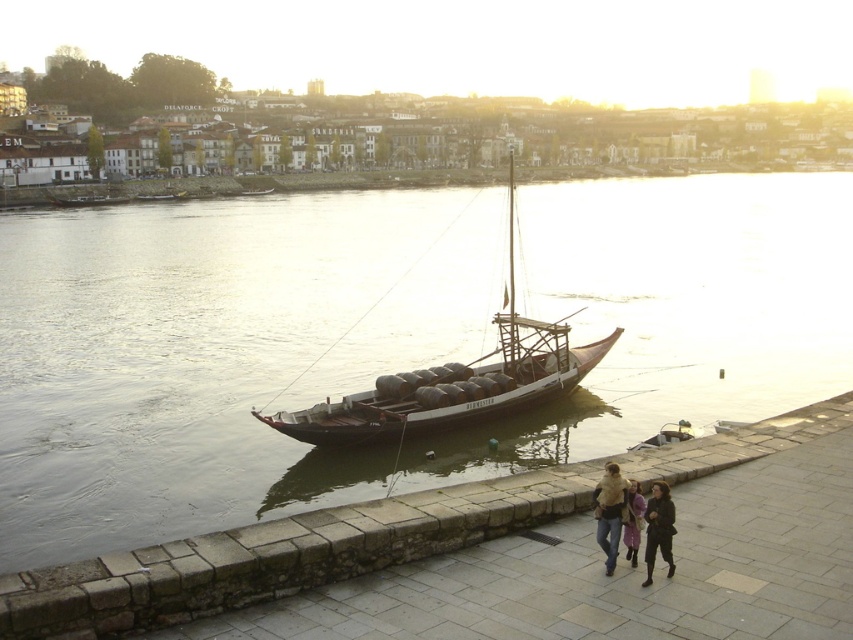
Question: Which object is the closest to the transparent water at center?

Choices:
 (A) smooth stone walkway at lower center
 (B) wooden barrel boat at center

Answer: (B)

Question: Does transparent water at center lie behind smooth stone walkway at lower center?

Choices:
 (A) no
 (B) yes

Answer: (B)

Question: Which of the following is the closest to the observer?

Choices:
 (A) dark brown leather jacket at lower right
 (B) smooth stone walkway at lower center
 (C) wooden barrel boat at center
 (D) light purple fabric coat at lower center

Answer: (B)

Question: Is transparent water at center to the right of wooden barrel boat at center from the viewer's perspective?

Choices:
 (A) no
 (B) yes

Answer: (B)

Question: Is brown leather jacket at lower center thinner than light brown leather jacket at lower right?

Choices:
 (A) no
 (B) yes

Answer: (A)

Question: Among these objects, which one is nearest to the camera?

Choices:
 (A) transparent water at center
 (B) wooden barrel boat at center
 (C) light brown leather jacket at lower right
 (D) light purple fabric coat at lower center

Answer: (C)